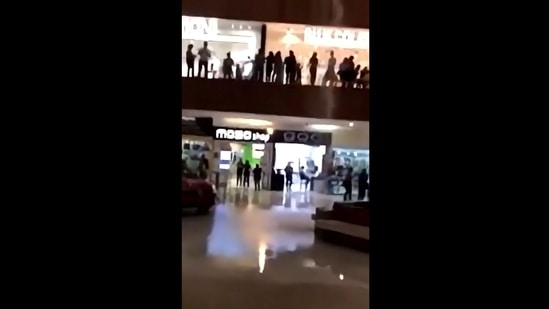
Find the location of a particular element. The height and width of the screenshot is (309, 549). couch is located at coordinates (349, 227).